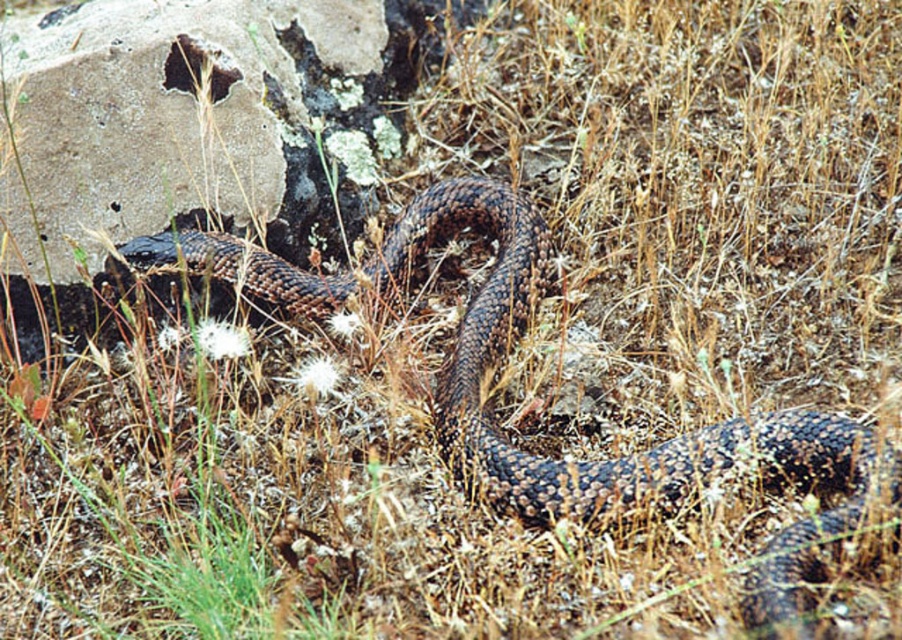
Question: Which object is the closest to the brown scaly snake at center?

Choices:
 (A) rough concrete boulder at left
 (B) dark brown rock at upper left

Answer: (A)

Question: Among these objects, which one is nearest to the camera?

Choices:
 (A) brown scaly snake at center
 (B) rough concrete boulder at left

Answer: (A)

Question: Is brown scaly snake at center to the left of dark brown rock at upper left from the viewer's perspective?

Choices:
 (A) no
 (B) yes

Answer: (A)

Question: Which object is the closest to the dark brown rock at upper left?

Choices:
 (A) brown scaly snake at center
 (B) rough concrete boulder at left

Answer: (B)

Question: Does brown scaly snake at center have a greater width compared to dark brown rock at upper left?

Choices:
 (A) no
 (B) yes

Answer: (B)

Question: Is rough concrete boulder at left bigger than brown scaly snake at center?

Choices:
 (A) yes
 (B) no

Answer: (B)